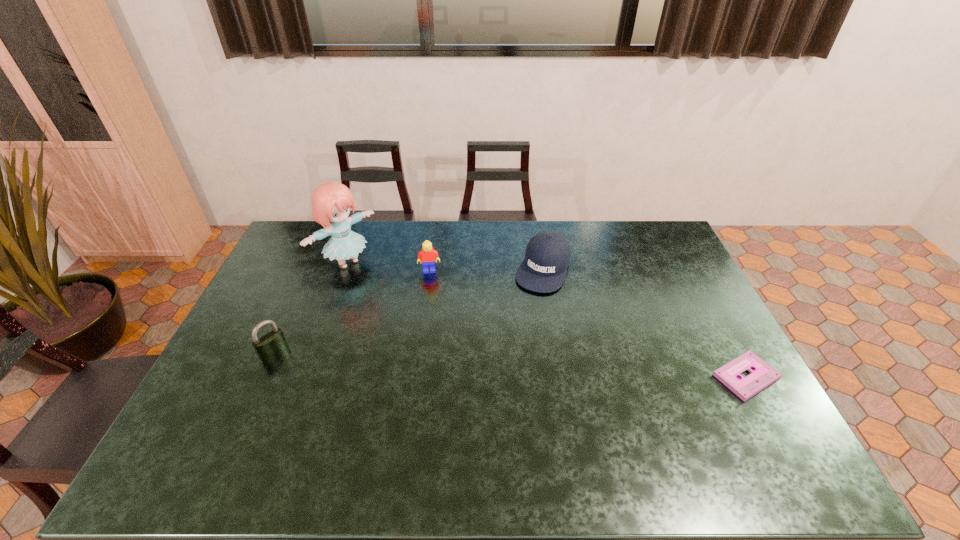
You are a GUI agent. You are given a task and a screenshot of the screen. Output one action in this format:
    pyautogui.click(x=<x>, y=<y>)
    Task: Click on the vacant space in between the fourth tallest object and the shortest object
    
    Given the screenshot: What is the action you would take?
    pyautogui.click(x=644, y=323)

Locate which object is the fourth closest to the rightmost object. Please provide its 2D coordinates. Your answer should be formatted as a tuple, i.e. [(x, y)], where the tuple contains the x and y coordinates of a point satisfying the conditions above.

[(272, 344)]

Identify which object is the second nearest to the padlock. Please provide its 2D coordinates. Your answer should be formatted as a tuple, i.e. [(x, y)], where the tuple contains the x and y coordinates of a point satisfying the conditions above.

[(427, 256)]